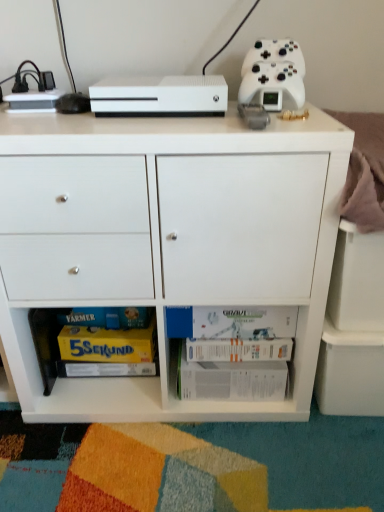
You are a GUI agent. You are given a task and a screenshot of the screen. Output one action in this format:
    pyautogui.click(x=<x>, y=<y>)
    Task: Click on the free point above white paper book at lower center, the 2th book in the top-to-bottom sequence (from a real-world perspective)
    
    Given the screenshot: What is the action you would take?
    pyautogui.click(x=227, y=360)